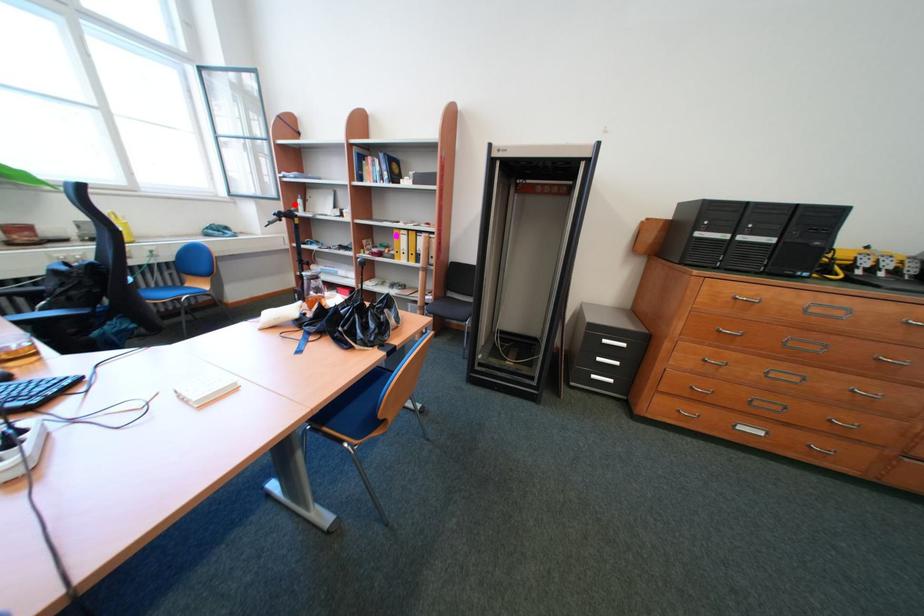
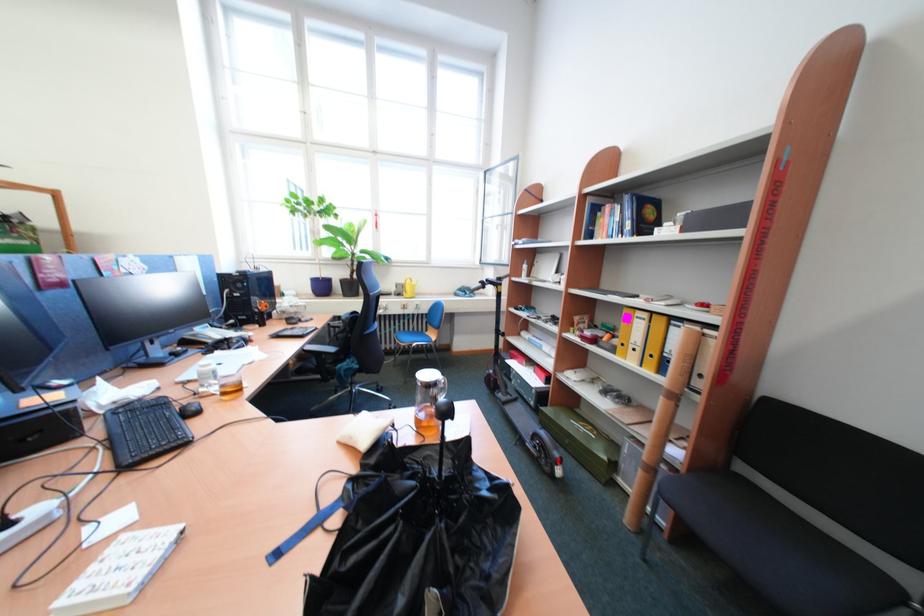
In the second image, find the point that corresponds to the highlighted location in the first image.

(523, 270)